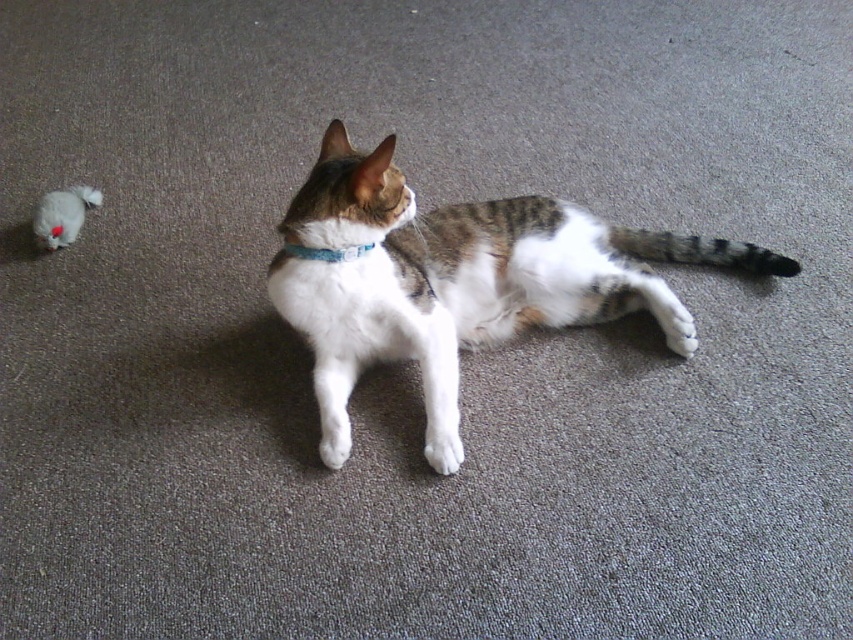
You are standing in the room where the cat is lying. There are two points marked in the image. One is at coordinates point (x=36, y=234) and the other is at point (x=445, y=442). Which point is closer to you?

Point (x=36, y=234) is closer to you because it is further to the viewer than point (x=445, y=442).

You are a cat owner who wants to place a new toy for your cat. The cat is currently lying on its side on a carpeted floor. You have a new toy that needs to be placed at point [62,214]. Will the new toy be placed near the existing white plush toy at left?

The point [62,214] is where the white plush toy at left is located, so placing the new toy there would position it near the existing white plush toy at left.

You are a cat owner who wants to place a new toy for your cat. The cat is currently lying on its side on the carpeted floor. You have a white plush toy at left and white fur at lower center. Which toy is taller?

The white plush toy at left is taller than the white fur at lower center.